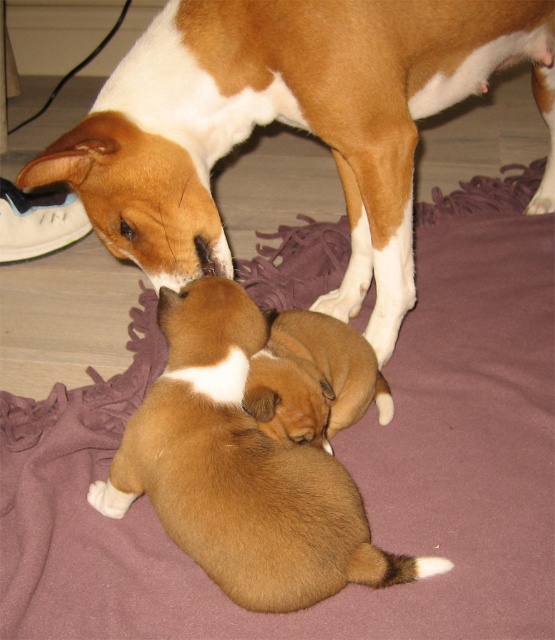
Question: Can you confirm if brown matte dog at center is positioned above brown furry puppies at lower center?

Choices:
 (A) yes
 (B) no

Answer: (A)

Question: Which of the following is the farthest from the observer?

Choices:
 (A) (312, 340)
 (B) (188, 554)

Answer: (A)

Question: Which is farther from the brown furry puppy at center?

Choices:
 (A) brown matte dog at center
 (B) brown furry puppies at lower center

Answer: (A)

Question: Is brown matte dog at center to the left of brown furry puppy at center from the viewer's perspective?

Choices:
 (A) yes
 (B) no

Answer: (B)

Question: Can you confirm if brown matte dog at center is smaller than brown furry puppy at center?

Choices:
 (A) yes
 (B) no

Answer: (B)

Question: Among these points, which one is nearest to the camera?

Choices:
 (A) (256, 416)
 (B) (199, 234)
 (C) (168, 339)

Answer: (A)